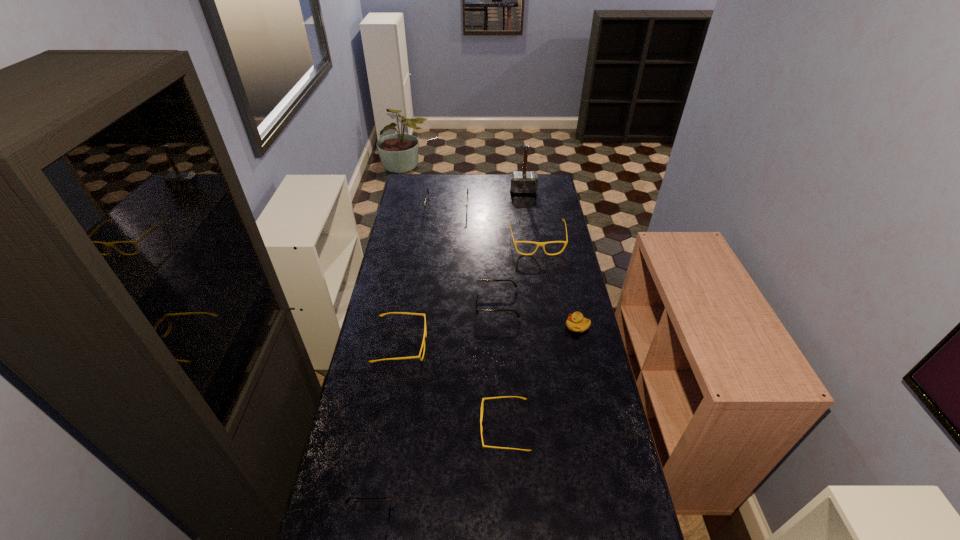
Where is `object that stands as the closest to the nearest beige spectacles`? The image size is (960, 540). object that stands as the closest to the nearest beige spectacles is located at coordinates (423, 343).

You are a GUI agent. You are given a task and a screenshot of the screen. Output one action in this format:
    pyautogui.click(x=<x>, y=<y>)
    Task: Click on the second closest object to the second smallest black spectacles
    Image resolution: width=960 pixels, height=540 pixels.
    Given the screenshot: What is the action you would take?
    pyautogui.click(x=423, y=343)

This screenshot has width=960, height=540. I want to click on spectacles that can be found as the second closest to the leftmost beige spectacles, so click(x=483, y=399).

Identify which spectacles is the fifth closest to the brown hammer. Please provide its 2D coordinates. Your answer should be formatted as a tuple, i.e. [(x, y)], where the tuple contains the x and y coordinates of a point satisfying the conditions above.

[(483, 399)]

Choose which beige spectacles is the third nearest neighbor to the third farthest spectacles. Please provide its 2D coordinates. Your answer should be formatted as a tuple, i.e. [(x, y)], where the tuple contains the x and y coordinates of a point satisfying the conditions above.

[(483, 399)]

Find the location of a particular element. beige spectacles that can be found as the second closest to the shortest object is located at coordinates (423, 343).

Point out which black spectacles is positioned as the nearest to the second nearest spectacles. Please provide its 2D coordinates. Your answer should be formatted as a tuple, i.e. [(x, y)], where the tuple contains the x and y coordinates of a point satisfying the conditions above.

[(389, 498)]

Locate an element on the screen. black spectacles that is the second closest to the duckling is located at coordinates (432, 210).

At what (x,y) coordinates should I click in order to perform the action: click on blank space that satisfies the following two spatial constraints: 1. on the front side of the tallest object; 2. in front of the lenses of the fourth farthest spectacles. Please return your answer as a coordinate pair (x, y). Looking at the image, I should click on (544, 345).

In order to click on blank space that satisfies the following two spatial constraints: 1. in front of the lenses of the third farthest object; 2. at the hinge ends of the rightmost black spectacles in this screenshot , I will do `click(547, 303)`.